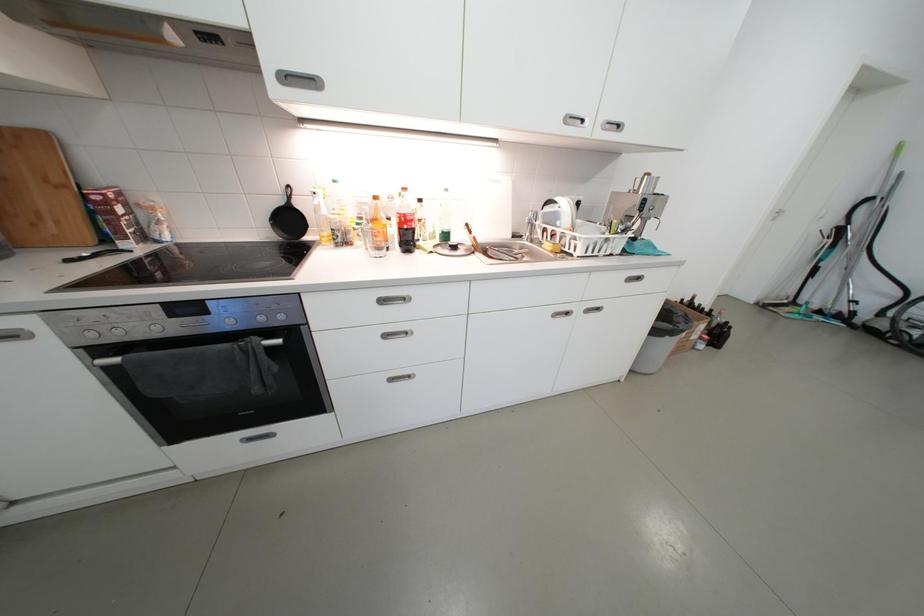
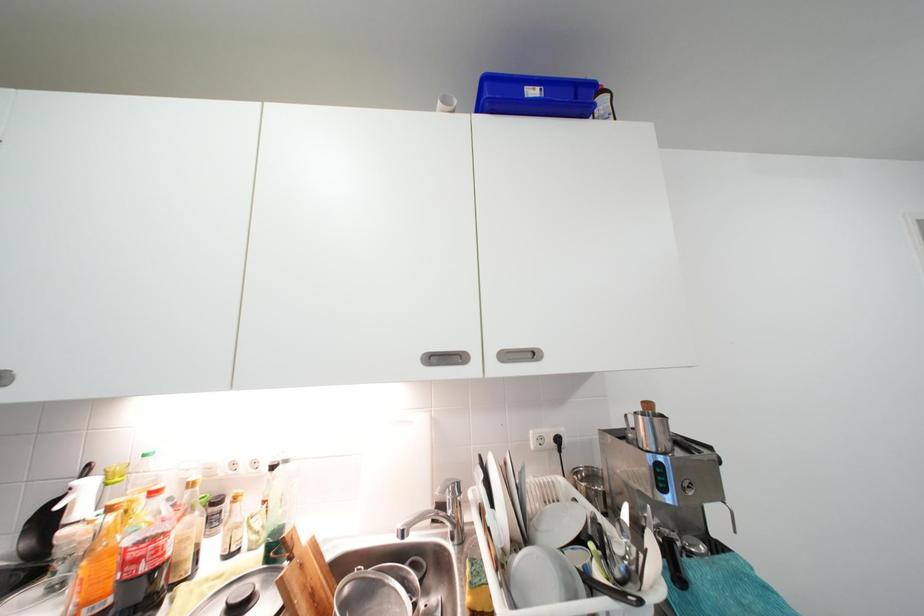
Question: Based on the continuous images, in which direction is the camera rotating? Reply with the corresponding letter.

Choices:
 (A) Left
 (B) Right
 (C) Up
 (D) Down

Answer: (C)